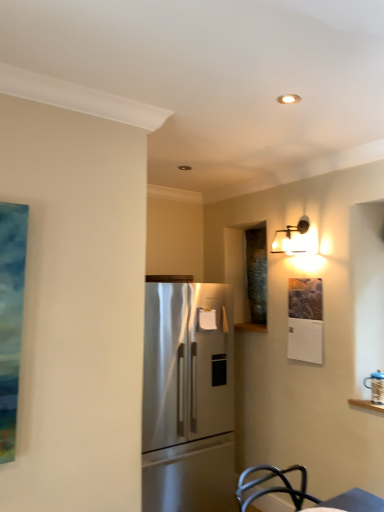
Question: Based on their sizes in the image, would you say satin stainless steel refrigerator at center is bigger or smaller than matte black sconce at upper right?

Choices:
 (A) big
 (B) small

Answer: (A)

Question: Considering the relative positions of satin stainless steel refrigerator at center and matte black sconce at upper right in the image provided, is satin stainless steel refrigerator at center to the left or to the right of matte black sconce at upper right?

Choices:
 (A) left
 (B) right

Answer: (A)

Question: From a real-world perspective, is satin stainless steel refrigerator at center above or below matte black sconce at upper right?

Choices:
 (A) above
 (B) below

Answer: (B)

Question: Which is correct: matte black sconce at upper right is inside satin stainless steel refrigerator at center, or outside of it?

Choices:
 (A) inside
 (B) outside

Answer: (B)

Question: From the image's perspective, is matte black sconce at upper right located above or below satin stainless steel refrigerator at center?

Choices:
 (A) above
 (B) below

Answer: (A)

Question: In terms of width, does matte black sconce at upper right look wider or thinner when compared to satin stainless steel refrigerator at center?

Choices:
 (A) thin
 (B) wide

Answer: (A)

Question: Is matte black sconce at upper right taller or shorter than satin stainless steel refrigerator at center?

Choices:
 (A) tall
 (B) short

Answer: (B)